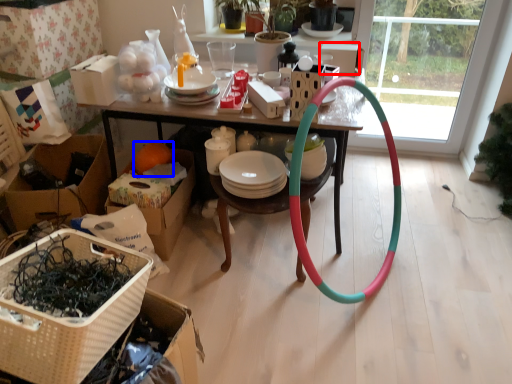
Question: Which object appears closest to the camera in this image, box (highlighted by a red box) or orange (highlighted by a blue box)?

Choices:
 (A) box
 (B) orange

Answer: (A)